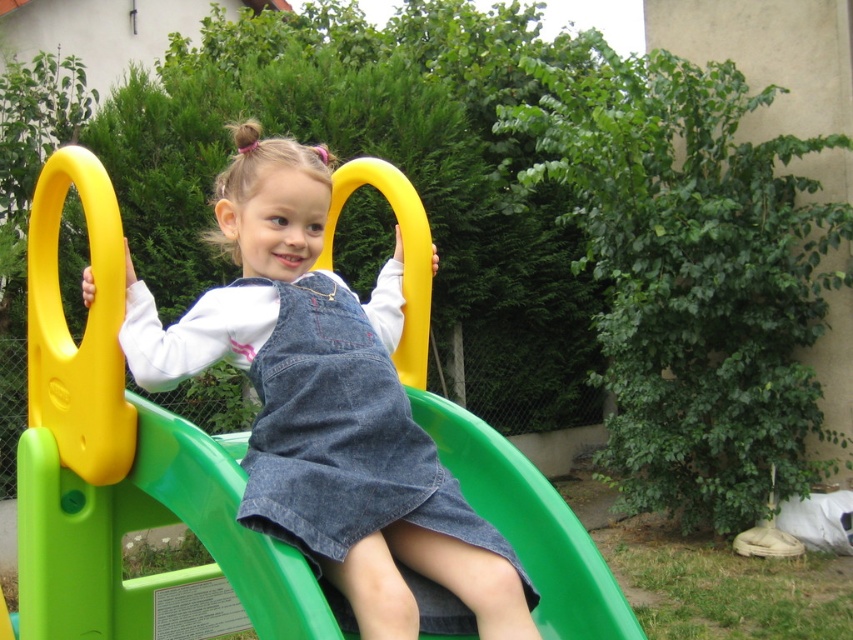
Question: Observing the image, what is the correct spatial positioning of denim overalls at center in reference to denim dress at center?

Choices:
 (A) below
 (B) above

Answer: (B)

Question: Among these objects, which one is farthest from the camera?

Choices:
 (A) denim dress at center
 (B) denim overalls at center

Answer: (B)

Question: Is denim overalls at center below denim dress at center?

Choices:
 (A) no
 (B) yes

Answer: (A)

Question: Which object appears farthest from the camera in this image?

Choices:
 (A) denim overalls at center
 (B) denim dress at center

Answer: (A)

Question: Which point is farther from the camera taking this photo?

Choices:
 (A) coord(323,412)
 (B) coord(390,486)

Answer: (A)

Question: Is the position of denim overalls at center less distant than that of denim dress at center?

Choices:
 (A) no
 (B) yes

Answer: (A)